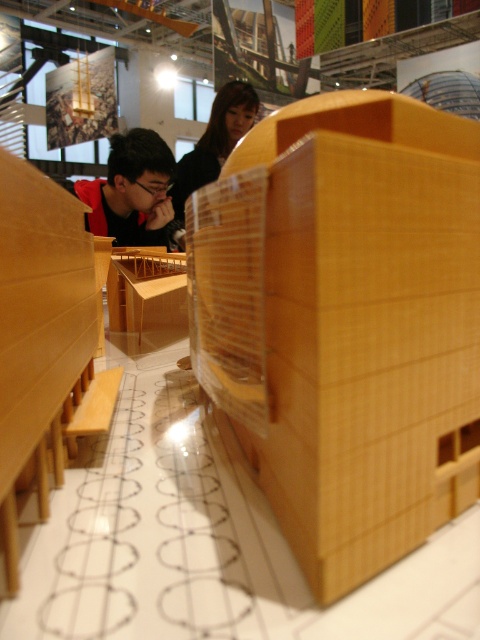
Does point (84, 196) come closer to viewer compared to point (216, 176)?

That is True.

Based on the photo, can you confirm if matte black shirt at left is taller than black hair at upper center?

No.

Who is more distant from viewer, [92,192] or [176,218]?

The point [176,218] is behind.

You are a GUI agent. You are given a task and a screenshot of the screen. Output one action in this format:
    pyautogui.click(x=<x>, y=<y>)
    Task: Click on the matte black shirt at left
    
    Given the screenshot: What is the action you would take?
    pyautogui.click(x=132, y=189)